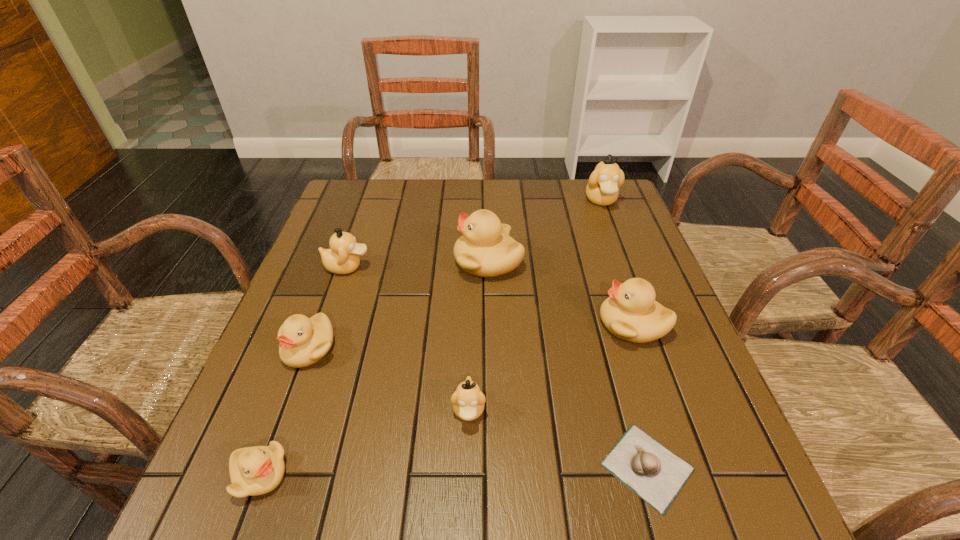
Identify the location of vacant point located on the face of the leftmost tan duckling. (504, 267).

In order to click on vacant area situated 0.170m on the beak of the second smallest yellow duckling in this screenshot , I will do `click(271, 453)`.

Where is `free space located on the face of the nearest tan duckling`? free space located on the face of the nearest tan duckling is located at coordinates (468, 490).

Locate an element on the screen. This screenshot has width=960, height=540. free space located 0.350m on the beak of the second shortest object is located at coordinates (497, 475).

Find the location of a particular element. free space located on the back of the garlic is located at coordinates (605, 318).

The height and width of the screenshot is (540, 960). I want to click on object present at the far edge, so click(x=602, y=189).

At what (x,y) coordinates should I click in order to perform the action: click on duckling present at the near edge. Please return your answer as a coordinate pair (x, y). Looking at the image, I should click on (x=257, y=470).

At what (x,y) coordinates should I click in order to perform the action: click on garlic that is at the near edge. Please return your answer as a coordinate pair (x, y). Looking at the image, I should click on (653, 472).

In order to click on garlic that is at the right edge in this screenshot , I will do `click(653, 472)`.

Where is `object positioned at the near left corner`? This screenshot has height=540, width=960. object positioned at the near left corner is located at coordinates (257, 470).